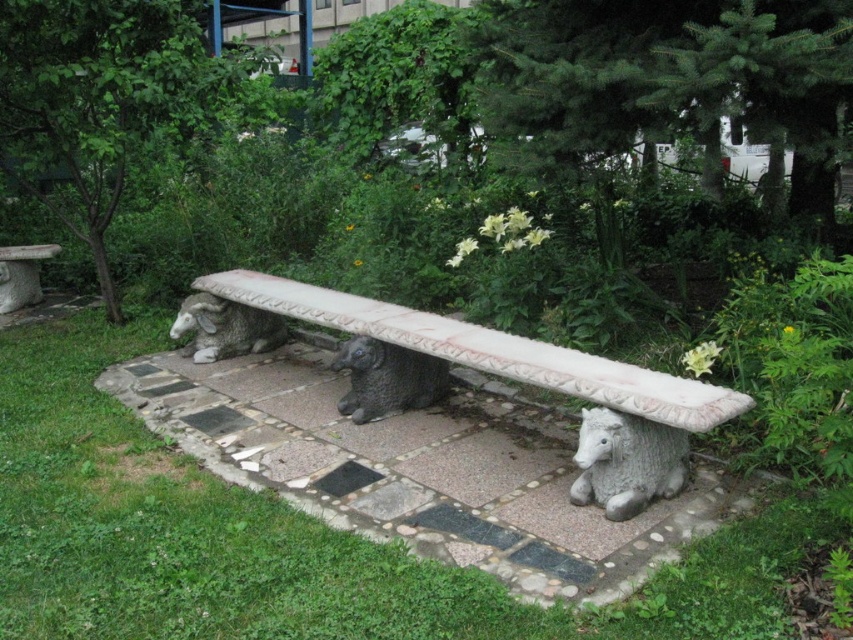
Who is shorter, gray stone sheep at lower right or gray stone bench at left?

Standing shorter between the two is gray stone sheep at lower right.

Between point (622, 438) and point (19, 244), which one is positioned in front?

Point (622, 438) is in front.

Which is in front, point (619, 497) or point (15, 262)?

Point (619, 497)

In order to click on gray stone sheep at lower right in this screenshot , I will do `click(625, 461)`.

Which of these two, white stone bench at center or gray stone bench at center, stands taller?

With more height is white stone bench at center.

Is point (495, 464) farther from camera compared to point (437, 352)?

That is True.

Who is more forward, (x=157, y=380) or (x=531, y=348)?

Positioned in front is point (x=531, y=348).

I want to click on white stone bench at center, so click(421, 468).

In the scene shown: Which is above, gray stone sheep at lower right or gray stone sheep at center?

gray stone sheep at center is above.

Is point (686, 465) in front of point (363, 360)?

Yes.

Between point (605, 429) and point (445, 372), which one is positioned in front?

Positioned in front is point (605, 429).

You are a GUI agent. You are given a task and a screenshot of the screen. Output one action in this format:
    pyautogui.click(x=<x>, y=<y>)
    Task: Click on the gray stone sheep at lower right
    This screenshot has width=853, height=640.
    Given the screenshot: What is the action you would take?
    pyautogui.click(x=625, y=461)